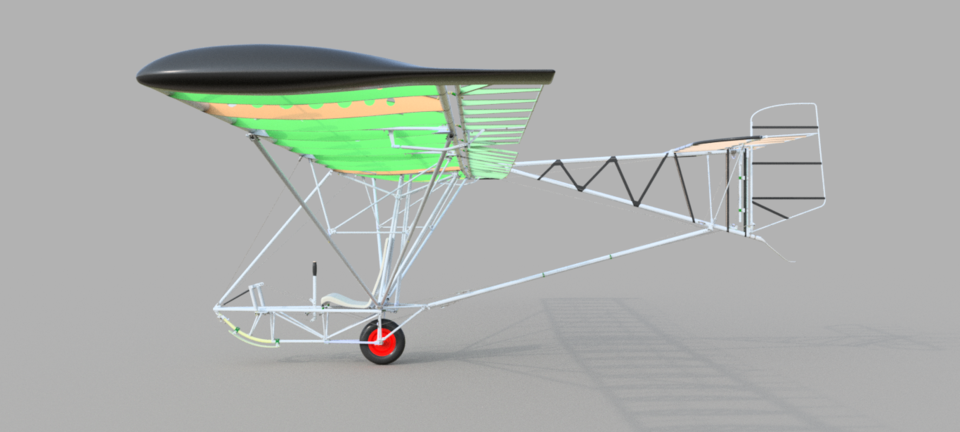
Locate an element on the screen. This screenshot has width=960, height=432. foot rest is located at coordinates (257, 300).